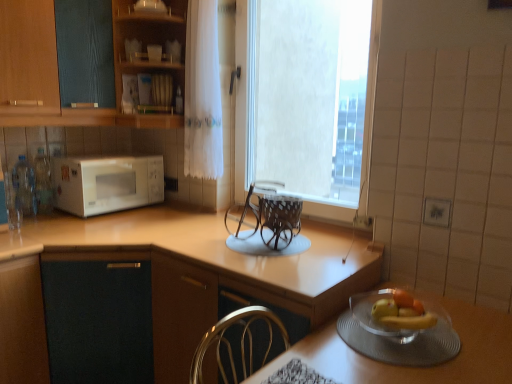
Question: Is clear glass bottle at left, which is the second bottle from left to right, closer to camera compared to white textured window at center?

Choices:
 (A) yes
 (B) no

Answer: (B)

Question: Considering the relative sizes of clear glass bottle at left, which is the 1th bottle in right-to-left order, and white textured window at center in the image provided, is clear glass bottle at left, which is the 1th bottle in right-to-left order, bigger than white textured window at center?

Choices:
 (A) yes
 (B) no

Answer: (B)

Question: Considering the relative sizes of clear glass bottle at left, which is the 1th bottle in right-to-left order, and white textured window at center in the image provided, is clear glass bottle at left, which is the 1th bottle in right-to-left order, shorter than white textured window at center?

Choices:
 (A) yes
 (B) no

Answer: (A)

Question: Does clear glass bottle at left, which is the 1th bottle in right-to-left order, come behind white textured window at center?

Choices:
 (A) yes
 (B) no

Answer: (A)

Question: From the image's perspective, is clear glass bottle at left, which is the 1th bottle in right-to-left order, beneath white textured window at center?

Choices:
 (A) no
 (B) yes

Answer: (B)

Question: In the image, is clear glass bowl at lower right positioned in front of or behind clear plastic bottles at left, which is counted as the second bottle, starting from the right?

Choices:
 (A) front
 (B) behind

Answer: (A)

Question: Is clear glass bowl at lower right taller or shorter than clear plastic bottles at left, the first bottle in the left-to-right sequence?

Choices:
 (A) tall
 (B) short

Answer: (A)

Question: From a real-world perspective, relative to clear plastic bottles at left, the first bottle in the left-to-right sequence, is clear glass bowl at lower right vertically above or below?

Choices:
 (A) below
 (B) above

Answer: (A)

Question: Is clear glass bowl at lower right inside the boundaries of clear plastic bottles at left, the first bottle in the left-to-right sequence, or outside?

Choices:
 (A) inside
 (B) outside

Answer: (B)

Question: Is point (503, 362) positioned closer to the camera than point (97, 157)?

Choices:
 (A) closer
 (B) farther

Answer: (A)

Question: Based on their sizes in the image, would you say clear glass bowl at lower right is bigger or smaller than white matte microwave at left?

Choices:
 (A) small
 (B) big

Answer: (B)

Question: From the image's perspective, is clear glass bowl at lower right above or below white matte microwave at left?

Choices:
 (A) below
 (B) above

Answer: (A)

Question: Is clear glass bowl at lower right situated inside white matte microwave at left or outside?

Choices:
 (A) inside
 (B) outside

Answer: (B)

Question: From the image's perspective, is clear plastic bottles at left, which is counted as the second bottle, starting from the right, positioned above or below brown woven basket at center?

Choices:
 (A) above
 (B) below

Answer: (A)

Question: From a real-world perspective, relative to brown woven basket at center, is clear plastic bottles at left, which is counted as the second bottle, starting from the right, vertically above or below?

Choices:
 (A) above
 (B) below

Answer: (A)